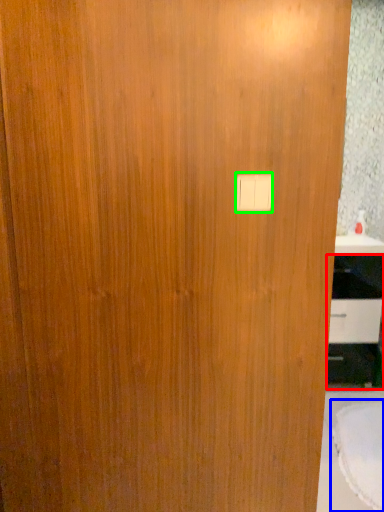
Question: Which is farther away from cabinetry (highlighted by a red box)? round table (highlighted by a blue box) or light switch (highlighted by a green box)?

Choices:
 (A) round table
 (B) light switch

Answer: (B)